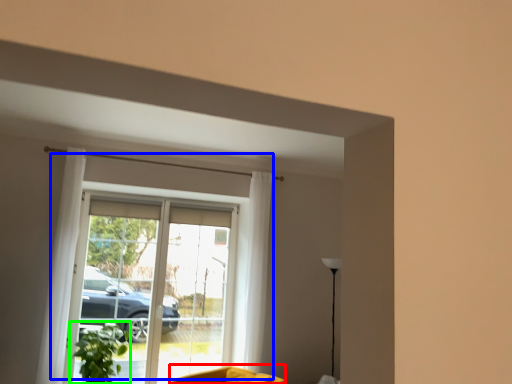
Question: Which object is positioned farthest from swivel chair (highlighted by a red box)? Select from window (highlighted by a blue box) and houseplant (highlighted by a green box).

Choices:
 (A) window
 (B) houseplant

Answer: (A)